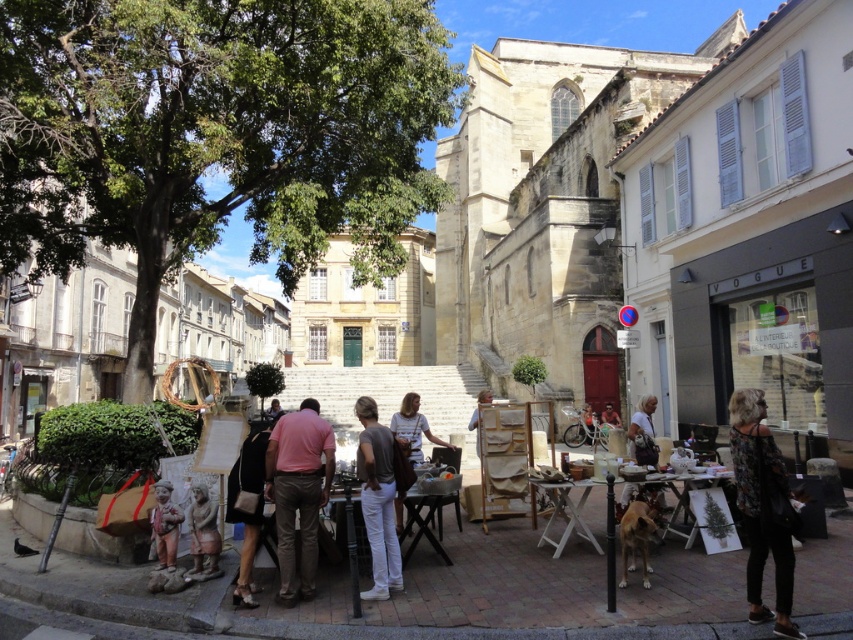
Question: Estimate the real-world distances between objects in this image. Which object is farther from the leather handbag at lower left?

Choices:
 (A) matte brown statue at lower left
 (B) white textured shirt at center

Answer: (B)

Question: Estimate the real-world distances between objects in this image. Which object is closer to the white cotton shirt at center?

Choices:
 (A) white textured shirt at center
 (B) floral-patterned fabric at lower right

Answer: (A)

Question: Does floral-patterned fabric at lower right have a greater width compared to leather handbag at lower left?

Choices:
 (A) no
 (B) yes

Answer: (A)

Question: Is wooden easel at center bigger than white cotton pants at center?

Choices:
 (A) yes
 (B) no

Answer: (A)

Question: Is wooden crates at center behind white cotton shirt at center?

Choices:
 (A) no
 (B) yes

Answer: (A)

Question: Which of the following is the farthest from the observer?

Choices:
 (A) white cotton pants at center
 (B) wooden crates at center
 (C) pink cotton shirt at center

Answer: (A)